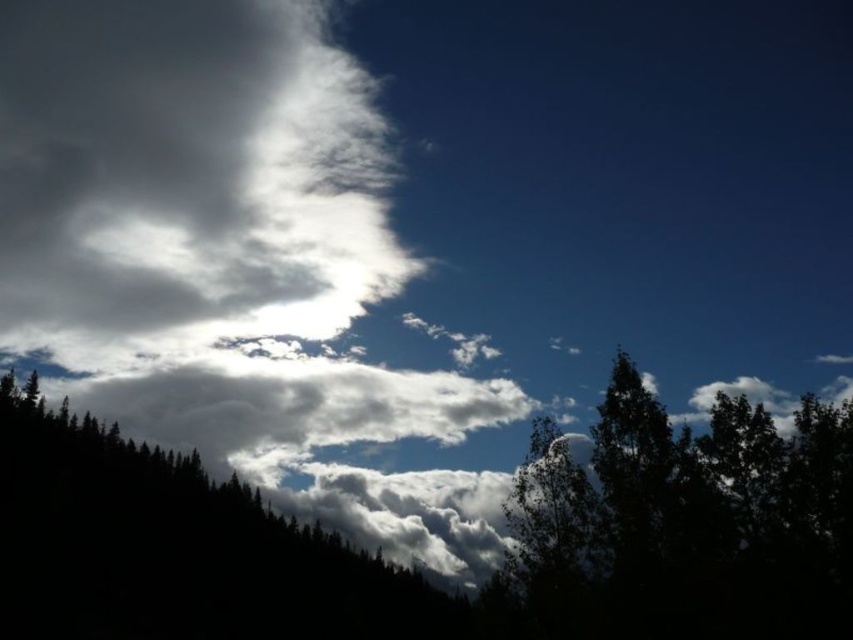
You are an artist trying to paint this scene. You need to decide which area to focus on first based on their sizes. Which object is wider, the dark green foliage at lower center or the green leafy tree at center?

The dark green foliage at lower center might be wider than green leafy tree at center according to the description.

You are an artist planning to paint this sky scene. You want to ensure the white fluffy cloud at upper left and the green leafy tree at center are proportionally accurate. Which object should you paint larger?

The white fluffy cloud at upper left should be painted larger since it has a larger size compared to the green leafy tree at center according to the description.